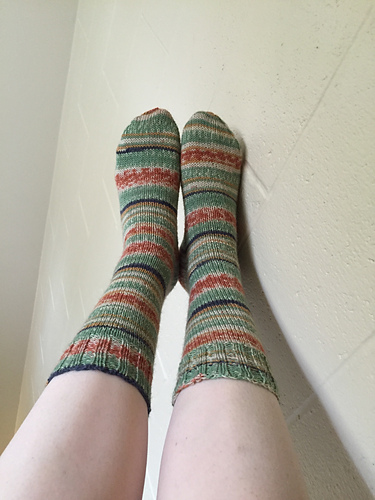
The image size is (375, 500). In order to click on painted block wall in this screenshot , I will do `click(329, 333)`.